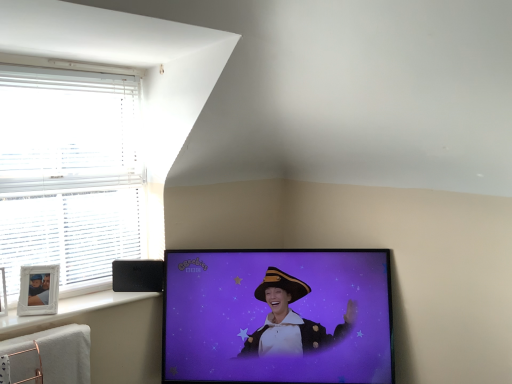
Question: From the image's perspective, is black plastic speaker at lower left above black glossy tv at center?

Choices:
 (A) yes
 (B) no

Answer: (A)

Question: Is the depth of black plastic speaker at lower left greater than that of black glossy tv at center?

Choices:
 (A) yes
 (B) no

Answer: (A)

Question: Is black plastic speaker at lower left oriented towards black glossy tv at center?

Choices:
 (A) yes
 (B) no

Answer: (B)

Question: Is black plastic speaker at lower left closer to the viewer compared to black glossy tv at center?

Choices:
 (A) no
 (B) yes

Answer: (A)

Question: From a real-world perspective, is black plastic speaker at lower left on black glossy tv at center?

Choices:
 (A) yes
 (B) no

Answer: (A)

Question: Does black plastic speaker at lower left have a greater height compared to black glossy tv at center?

Choices:
 (A) no
 (B) yes

Answer: (A)

Question: From a real-world perspective, is white blinds at left physically above white plastic frame at lower left?

Choices:
 (A) no
 (B) yes

Answer: (B)

Question: Considering the relative sizes of white blinds at left and white plastic frame at lower left in the image provided, is white blinds at left shorter than white plastic frame at lower left?

Choices:
 (A) yes
 (B) no

Answer: (B)

Question: From the image's perspective, does white blinds at left appear higher than white plastic frame at lower left?

Choices:
 (A) no
 (B) yes

Answer: (B)

Question: Does white blinds at left have a smaller size compared to white plastic frame at lower left?

Choices:
 (A) no
 (B) yes

Answer: (A)

Question: Is white blinds at left to the right of white plastic frame at lower left from the viewer's perspective?

Choices:
 (A) no
 (B) yes

Answer: (A)

Question: Is white blinds at left thinner than white plastic frame at lower left?

Choices:
 (A) yes
 (B) no

Answer: (A)

Question: Does black glossy tv at center turn towards white plastic frame at lower left?

Choices:
 (A) no
 (B) yes

Answer: (A)